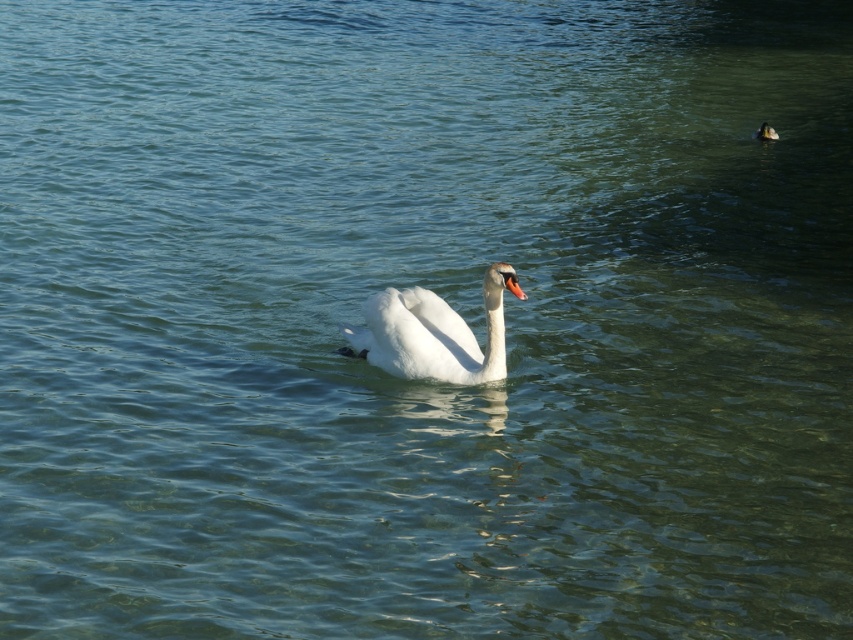
Between white glossy swan at center and white matte duck at center, which one has more height?

With more height is white glossy swan at center.

The image size is (853, 640). In order to click on white glossy swan at center in this screenshot , I will do `click(433, 333)`.

Locate an element on the screen. Image resolution: width=853 pixels, height=640 pixels. white glossy swan at center is located at coordinates (433, 333).